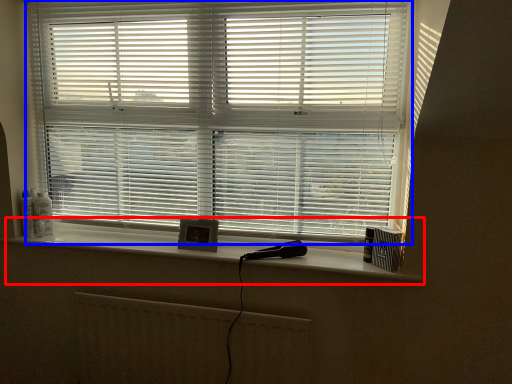
Question: Which object is closer to the camera taking this photo, window sill (highlighted by a red box) or window blind (highlighted by a blue box)?

Choices:
 (A) window sill
 (B) window blind

Answer: (B)